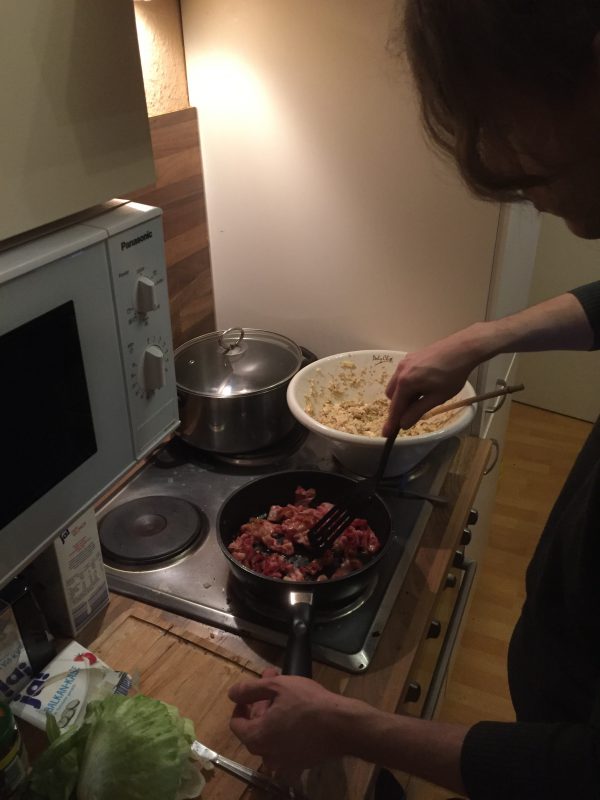
Locate an element on the screen. tan cutting board is located at coordinates (208, 672).